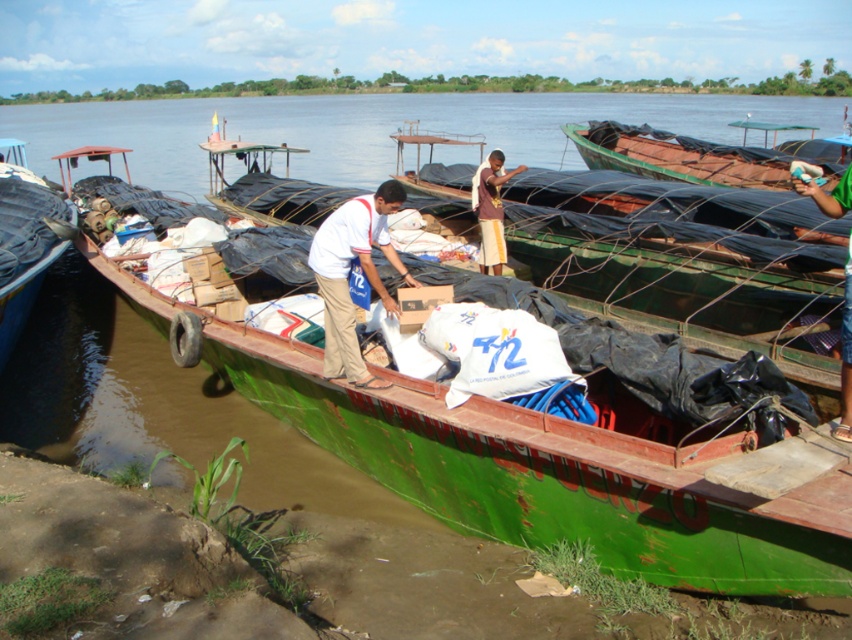
Does green fabric shirt at upper right have a lesser height compared to brown woven cloth at center?

Incorrect, green fabric shirt at upper right's height does not fall short of brown woven cloth at center's.

Can you confirm if green fabric shirt at upper right is thinner than brown woven cloth at center?

In fact, green fabric shirt at upper right might be wider than brown woven cloth at center.

Does point (825, 196) lie behind point (481, 163)?

No, it is in front of (481, 163).

Find the location of a particular element. The width and height of the screenshot is (852, 640). green fabric shirt at upper right is located at coordinates (845, 356).

Who is positioned more to the left, green wooden boat at upper right or green fabric shirt at upper right?

green fabric shirt at upper right is more to the left.

Does point (680, 138) lie behind point (842, 141)?

That is True.

Where is `green wooden boat at upper right`? green wooden boat at upper right is located at coordinates (677, 156).

Looking at this image, does green wooden boat at center lie behind blue tarpaulin boat at left?

No, green wooden boat at center is closer to the viewer.

Between green wooden boat at center and blue tarpaulin boat at left, which one has more height?

Standing taller between the two is blue tarpaulin boat at left.

Identify the location of green wooden boat at center. (533, 467).

Identify the location of green wooden boat at center. (533, 467).